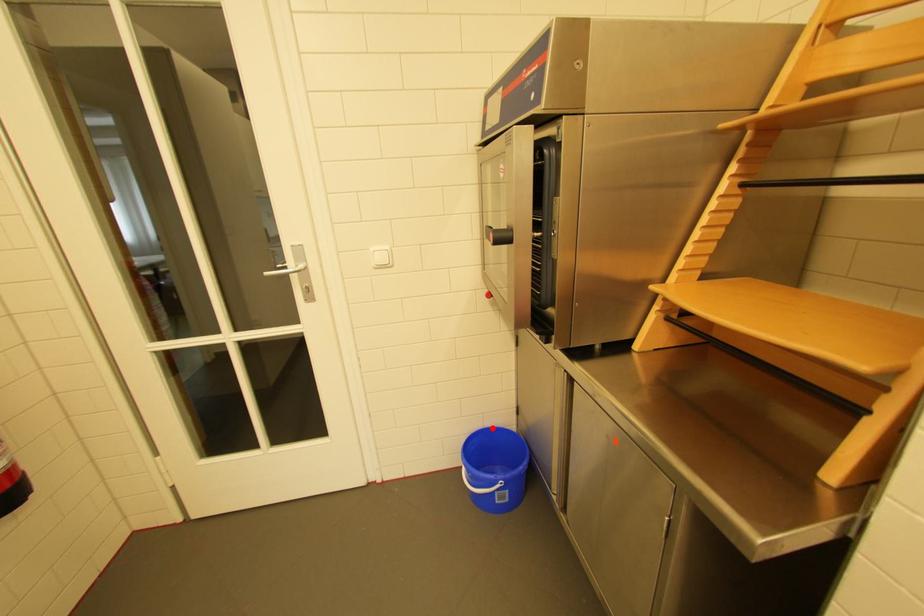
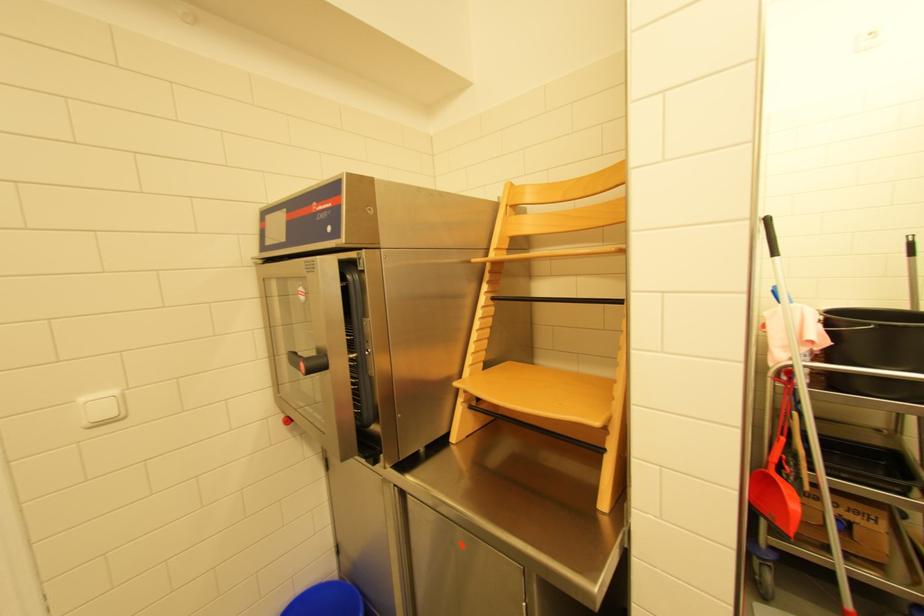
Where in the second image is the point corresponding to the highlighted location from the first image?

(304, 597)